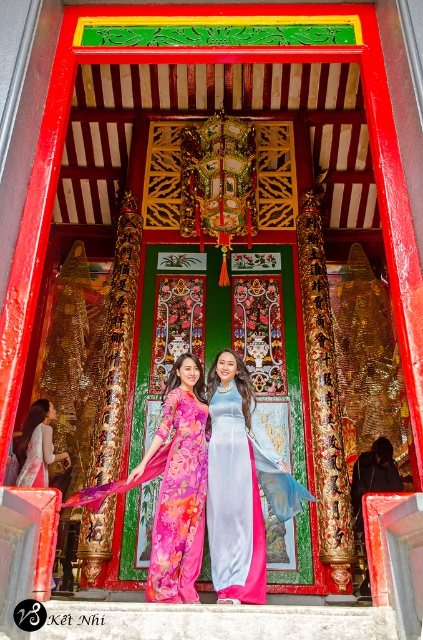
Question: Is silky blue dress at center wider than pink satin dress at center?

Choices:
 (A) no
 (B) yes

Answer: (B)

Question: Which object is the farthest from the pink satin dress at center?

Choices:
 (A) pink silk ao dai at center
 (B) floral silk dress at center

Answer: (B)

Question: Is floral silk dress at center closer to camera compared to pink satin dress at center?

Choices:
 (A) no
 (B) yes

Answer: (B)

Question: Among these points, which one is nearest to the camera?

Choices:
 (A) (18, 452)
 (B) (213, 404)

Answer: (B)

Question: Which point is closer to the camera?

Choices:
 (A) silky blue dress at center
 (B) floral silk dress at center
 (C) pink silk ao dai at center

Answer: (B)

Question: Is floral silk dress at center above pink satin dress at center?

Choices:
 (A) yes
 (B) no

Answer: (A)